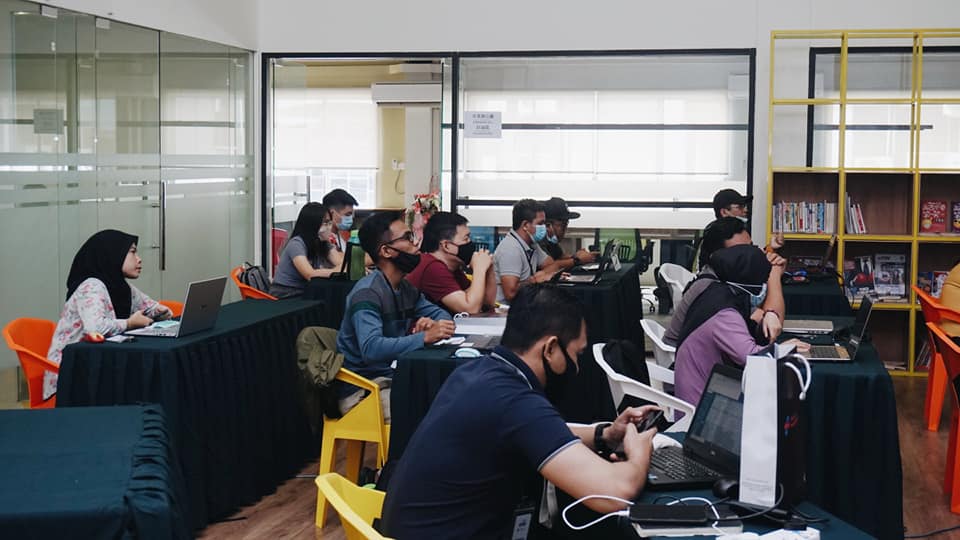
Locate an element on the screen. doorway is located at coordinates (364, 160).